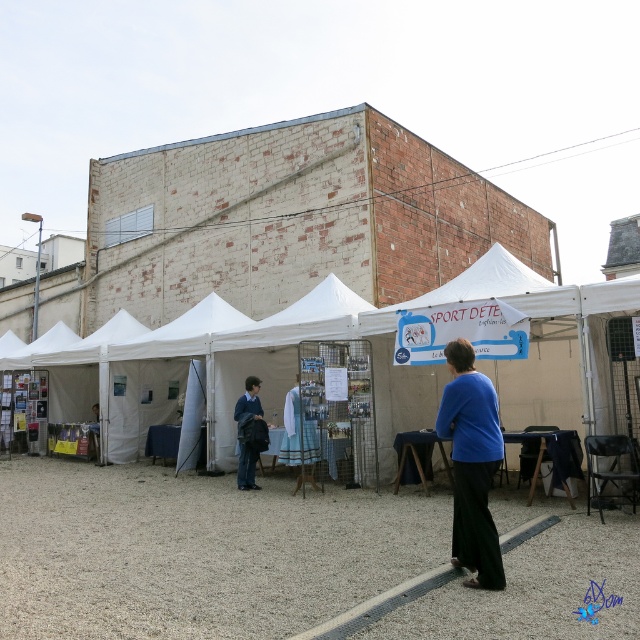
Who is more forward, [483,470] or [252,445]?

Point [483,470] is in front.

Is point (484, 497) more distant than point (252, 477)?

No, it is in front of (252, 477).

Does point (458, 344) come behind point (248, 412)?

No, (458, 344) is closer to viewer.

In order to click on blue matte shirt at center in this screenshot , I will do `click(472, 465)`.

Is white fabric tent at center further to camera compared to blue matte shirt at center?

No, it is not.

Which is behind, point (636, 577) or point (474, 560)?

The point (474, 560) is more distant.

Where is `white fabric tent at center`? The height and width of the screenshot is (640, 640). white fabric tent at center is located at coordinates (196, 552).

Between point (436, 554) and point (259, 436), which one is positioned behind?

Point (259, 436)

Who is more distant from viewer, (260, 604) or (237, 420)?

The point (237, 420) is more distant.

Where is `white fabric tent at center`? This screenshot has height=640, width=640. white fabric tent at center is located at coordinates (196, 552).